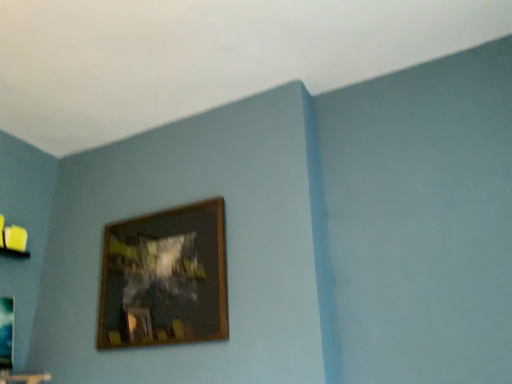
Locate an element on the screen. wooden frame at upper center is located at coordinates (165, 278).

This screenshot has width=512, height=384. What do you see at coordinates (165, 278) in the screenshot?
I see `wooden frame at upper center` at bounding box center [165, 278].

From the picture: Measure the distance between wooden frame at upper center and camera.

The depth of wooden frame at upper center is 1.51 meters.

The height and width of the screenshot is (384, 512). Find the location of `wooden frame at upper center`. wooden frame at upper center is located at coordinates (165, 278).